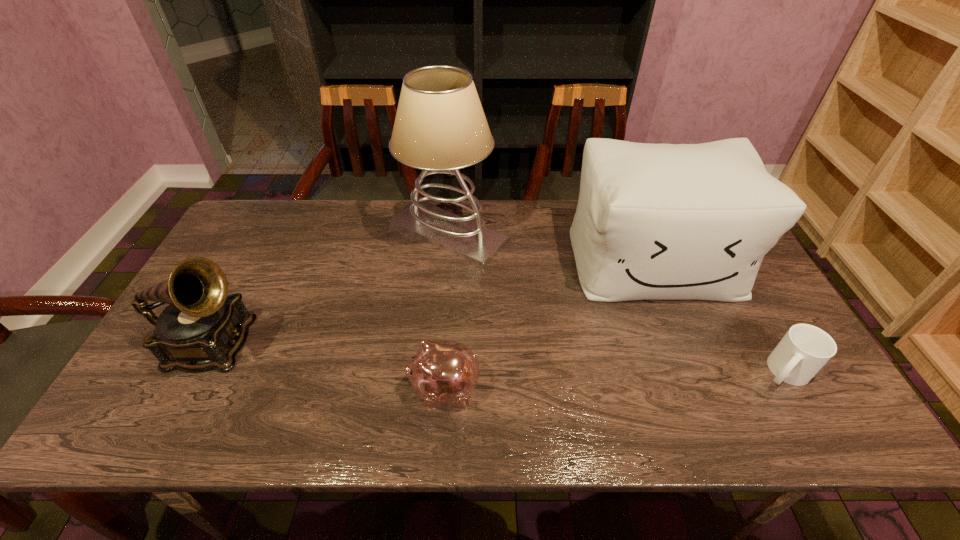
You are a GUI agent. You are given a task and a screenshot of the screen. Output one action in this format:
    pyautogui.click(x=<x>, y=<y>)
    Task: Click on the vacant space located 0.220m on the front facing side of the fourth tallest object
    
    Given the screenshot: What is the action you would take?
    (315, 389)

The height and width of the screenshot is (540, 960). Find the location of `vacant area located on the left of the mug`. vacant area located on the left of the mug is located at coordinates pos(729,372).

Where is `table lamp that is at the far edge`? This screenshot has width=960, height=540. table lamp that is at the far edge is located at coordinates (440, 127).

Image resolution: width=960 pixels, height=540 pixels. Identify the location of cushion located in the far edge section of the desktop. (654, 221).

I want to click on object situated at the near edge, so click(442, 372).

Locate an element on the screen. This screenshot has width=960, height=540. object that is at the left edge is located at coordinates (203, 328).

Find the location of a particular element. cushion present at the right edge is located at coordinates (654, 221).

Locate an element on the screen. mug that is at the right edge is located at coordinates (805, 349).

Find the location of a particular element. object that is at the far right corner is located at coordinates (654, 221).

The image size is (960, 540). I want to click on vacant space at the far edge of the desktop, so click(x=543, y=231).